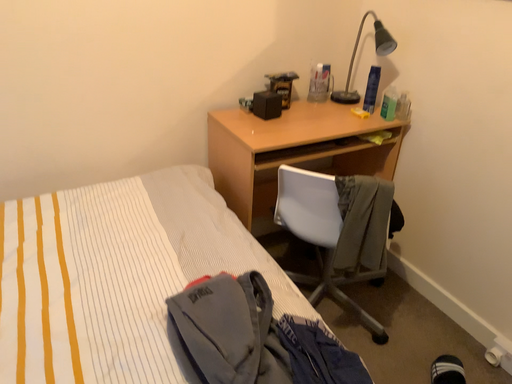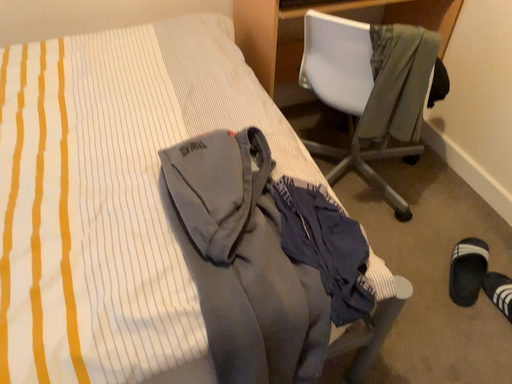
Question: Which way did the camera rotate in the video?

Choices:
 (A) rotated right
 (B) rotated left

Answer: (B)